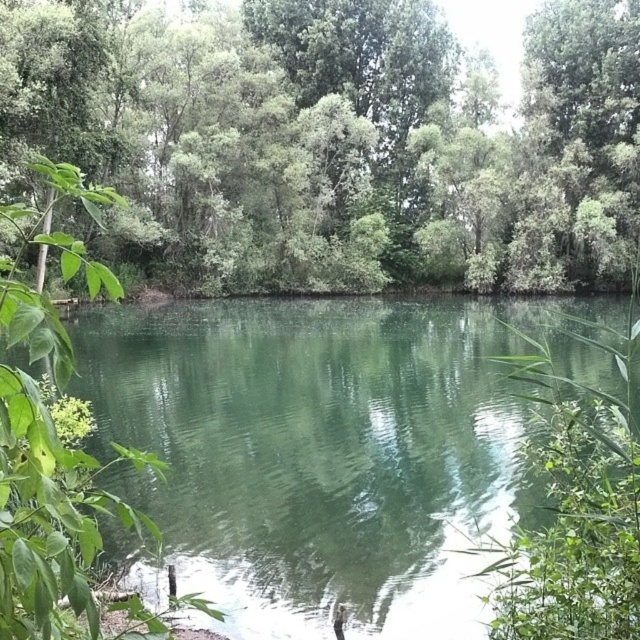
Question: Is green leafy tree at center to the right of green smooth water at center from the viewer's perspective?

Choices:
 (A) no
 (B) yes

Answer: (B)

Question: Which point is closer to the camera?

Choices:
 (A) green leafy tree at center
 (B) green smooth water at center

Answer: (B)

Question: Can you confirm if green leafy tree at center is wider than green smooth water at center?

Choices:
 (A) yes
 (B) no

Answer: (A)

Question: Which object is closer to the camera taking this photo?

Choices:
 (A) green smooth water at center
 (B) green leafy tree at center

Answer: (A)

Question: Can you confirm if green leafy tree at center is thinner than green smooth water at center?

Choices:
 (A) yes
 (B) no

Answer: (B)